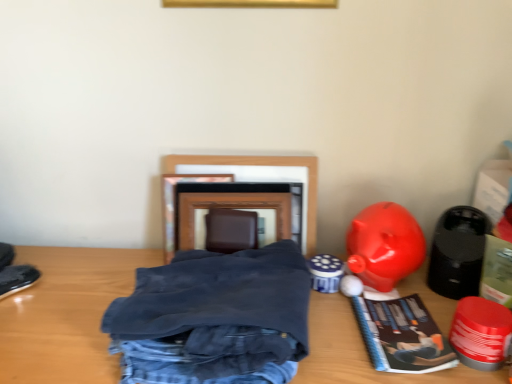
You are a GUI agent. You are given a task and a screenshot of the screen. Output one action in this format:
    pyautogui.click(x=<x>, y=<y>)
    Task: Click on the vacant space situated on the left part of shiny red plastic toy at lower right, the second toy from the right
    
    Given the screenshot: What is the action you would take?
    pyautogui.click(x=338, y=342)